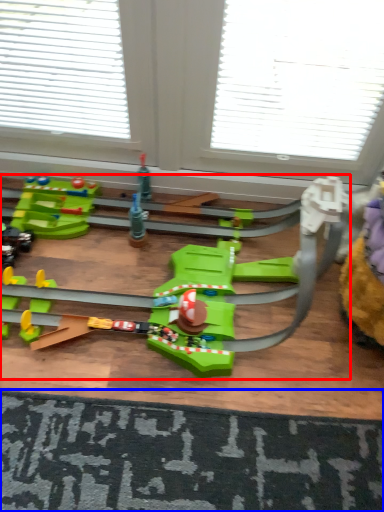
Question: Which of the following is the closest to the observer, toy (highlighted by a red box) or doormat (highlighted by a blue box)?

Choices:
 (A) toy
 (B) doormat

Answer: (A)